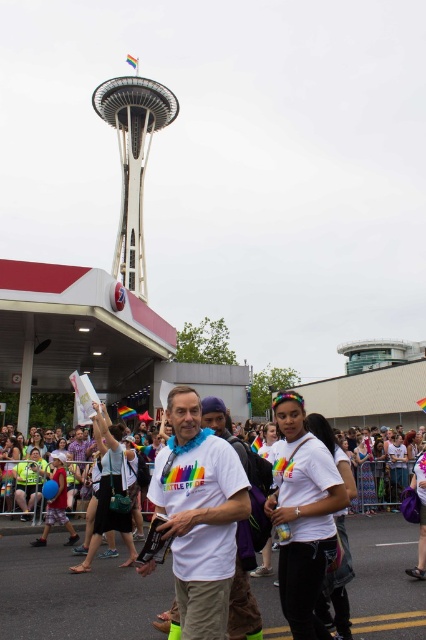
Is white matte t-shirt at center positioned at the back of white glass space needle at upper center?

No, it is not.

Which is behind, point (184, 435) or point (114, 116)?

Positioned behind is point (114, 116).

You are a GUI agent. You are given a task and a screenshot of the screen. Output one action in this format:
    pyautogui.click(x=<x>, y=<y>)
    Task: Click on the white matte t-shirt at center
    
    Given the screenshot: What is the action you would take?
    pyautogui.click(x=198, y=515)